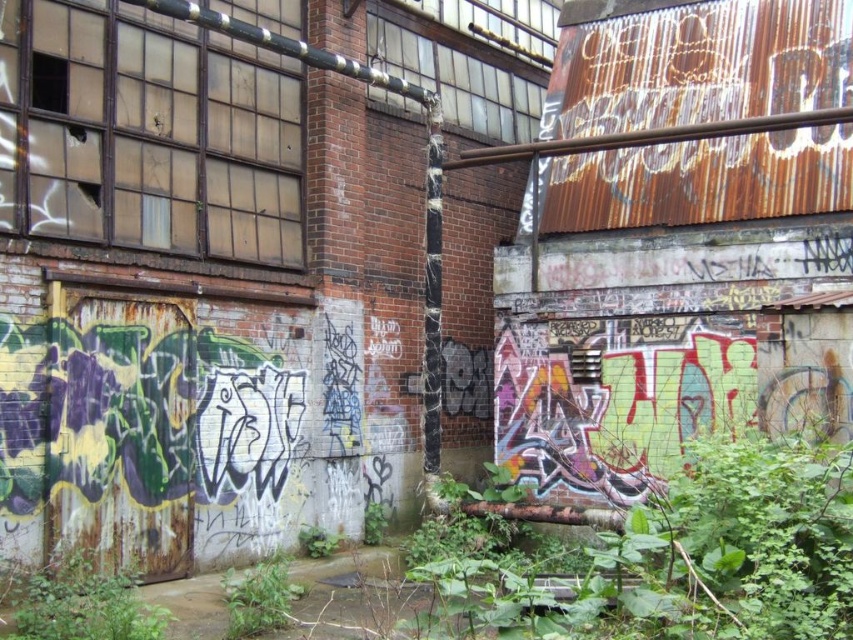
Question: Can you confirm if green leafy plant at lower left is wider than green leafy plant at lower center?

Choices:
 (A) no
 (B) yes

Answer: (B)

Question: Is green leafy plant at lower left to the left of green leafy plant at lower center from the viewer's perspective?

Choices:
 (A) yes
 (B) no

Answer: (A)

Question: Can you confirm if green leafy plant at lower left is smaller than green leafy plant at lower center?

Choices:
 (A) no
 (B) yes

Answer: (A)

Question: Which point appears farthest from the camera in this image?

Choices:
 (A) (258, 579)
 (B) (28, 576)

Answer: (A)